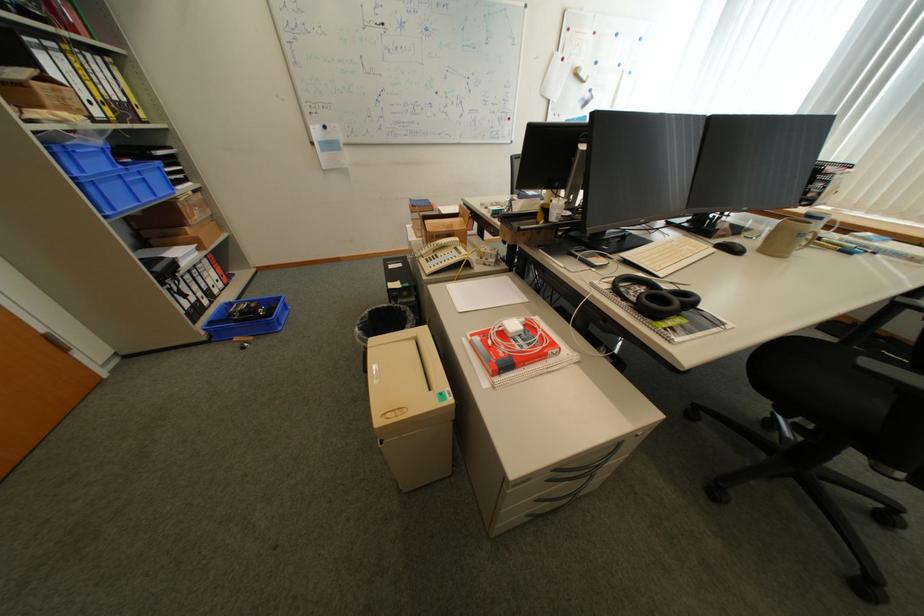
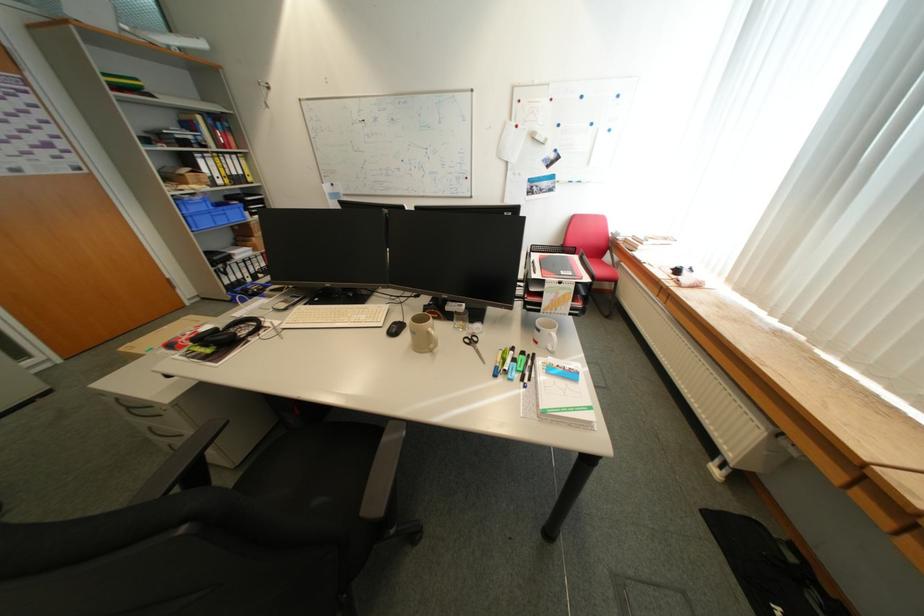
Find the pixel in the second image that matches (x=831, y=220) in the first image.

(548, 331)